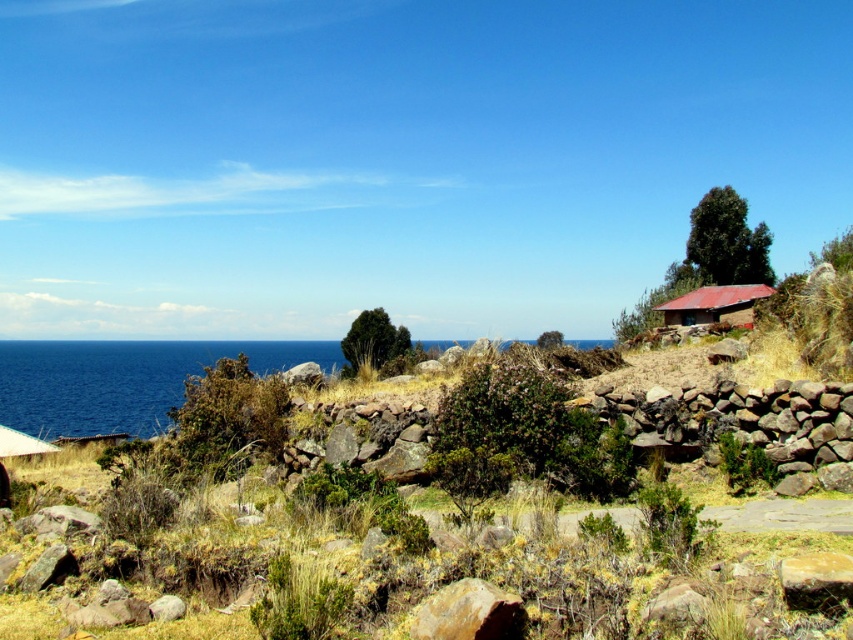
Question: Is blue water at left wider than brown clay hut at right?

Choices:
 (A) yes
 (B) no

Answer: (A)

Question: Which point is farther from the camera taking this photo?

Choices:
 (A) (691, 321)
 (B) (178, 348)

Answer: (B)

Question: Considering the relative positions of blue water at left and brown clay hut at right in the image provided, where is blue water at left located with respect to brown clay hut at right?

Choices:
 (A) right
 (B) left

Answer: (B)

Question: Considering the relative positions of blue water at left and brown clay hut at right in the image provided, where is blue water at left located with respect to brown clay hut at right?

Choices:
 (A) below
 (B) above

Answer: (A)

Question: Which object is farther from the camera taking this photo?

Choices:
 (A) blue water at left
 (B) brown clay hut at right

Answer: (A)